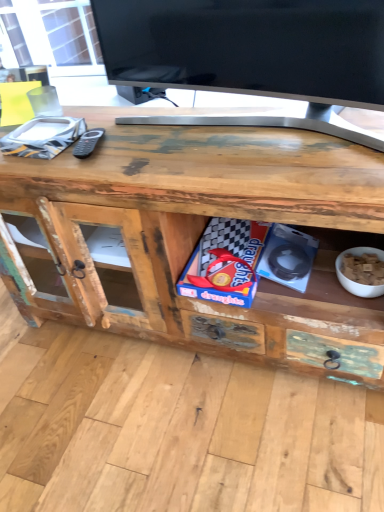
Locate an element on the screen. wooden table at center is located at coordinates (200, 234).

The height and width of the screenshot is (512, 384). What do you see at coordinates (200, 234) in the screenshot?
I see `wooden table at center` at bounding box center [200, 234].

The height and width of the screenshot is (512, 384). Identify the location of wooden table at center. (200, 234).